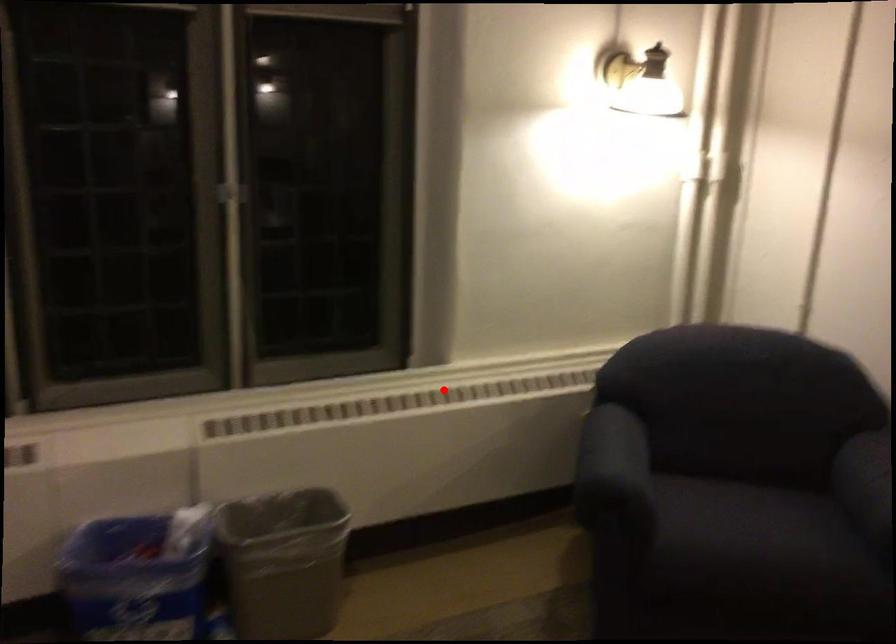
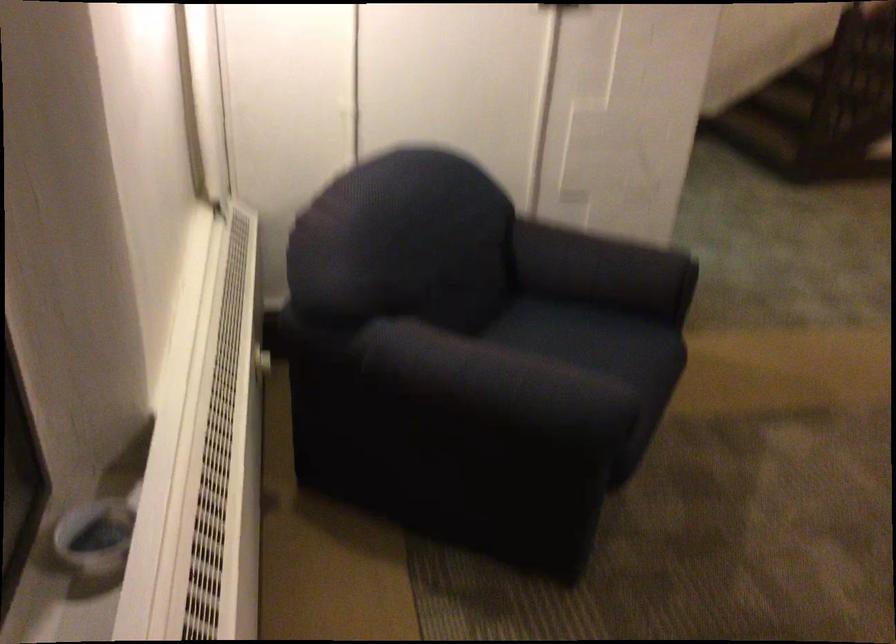
In the second image, find the point that corresponds to the highlighted location in the first image.

(218, 462)